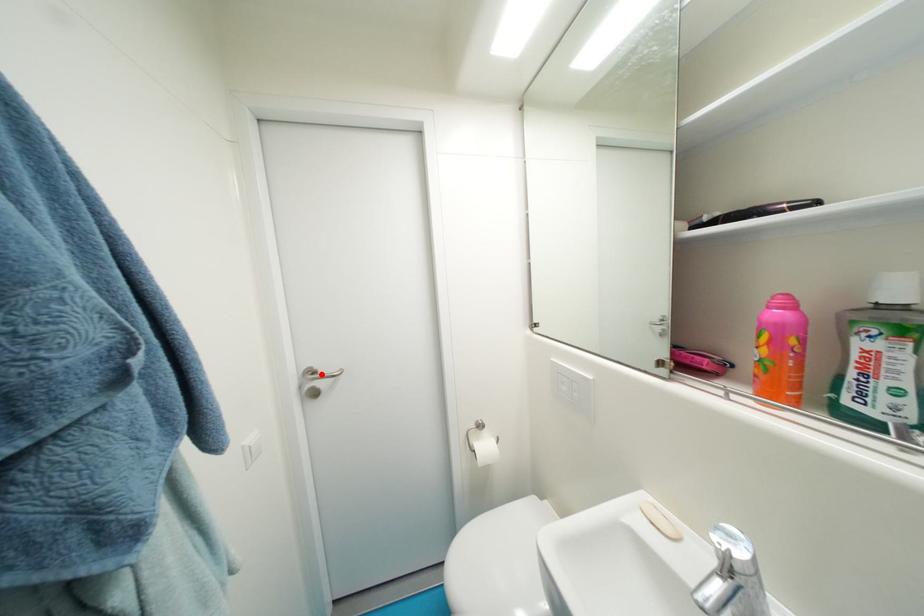
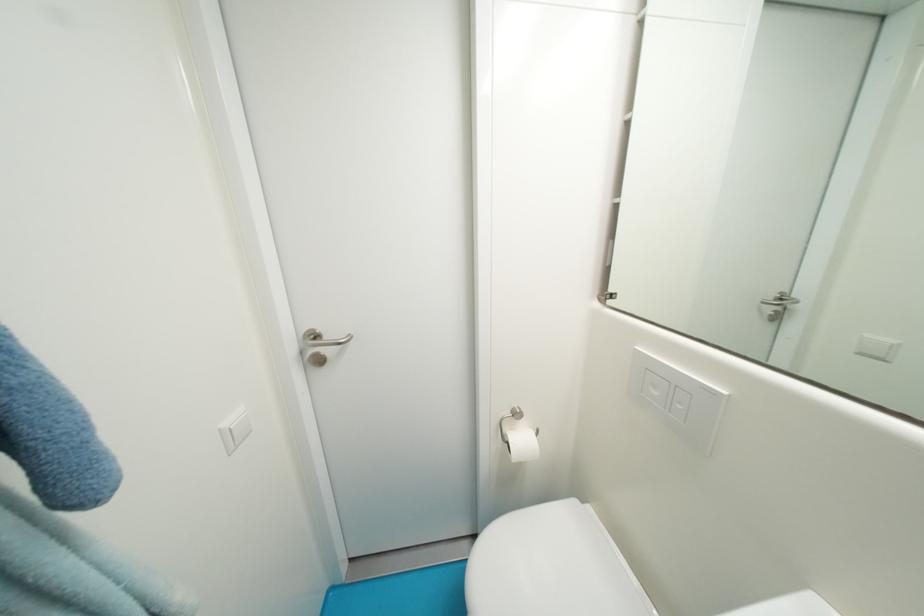
Find the pixel in the second image that matches the highlighted location in the first image.

(323, 339)